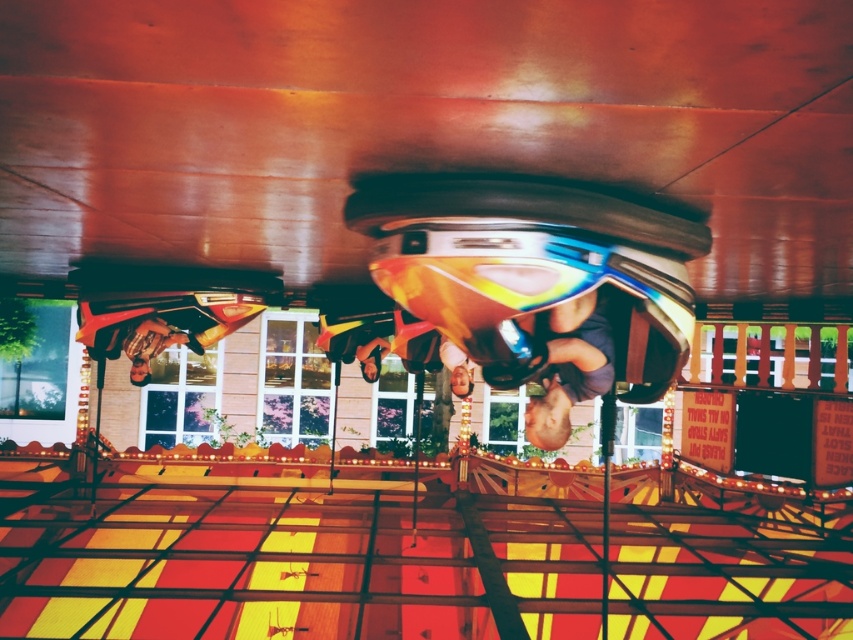
Question: Which point is closer to the camera?

Choices:
 (A) matte blue helmet at center
 (B) metallic gold helmet at left

Answer: (A)

Question: Does matte blue helmet at center lie in front of metallic gold helmet at left?

Choices:
 (A) no
 (B) yes

Answer: (B)

Question: Can you confirm if matte blue helmet at center is positioned above metallic gold helmet at left?

Choices:
 (A) no
 (B) yes

Answer: (A)

Question: Is matte blue helmet at center closer to camera compared to metallic gold helmet at left?

Choices:
 (A) no
 (B) yes

Answer: (B)

Question: Among these objects, which one is farthest from the camera?

Choices:
 (A) metallic gold helmet at left
 (B) matte blue helmet at center

Answer: (A)